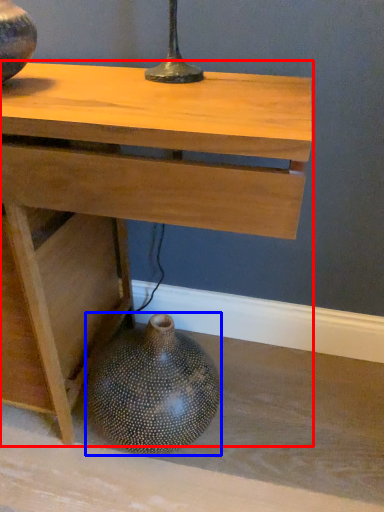
Question: Which object is further to the camera taking this photo, table (highlighted by a red box) or vase (highlighted by a blue box)?

Choices:
 (A) table
 (B) vase

Answer: (B)